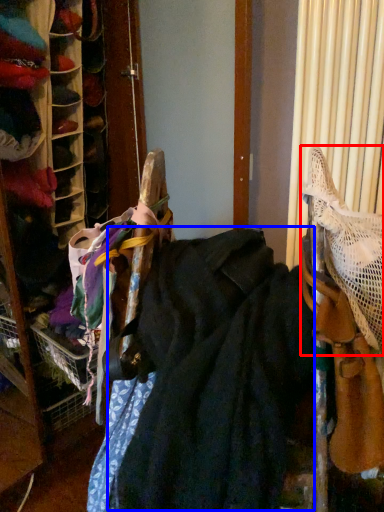
Question: Which object is closer to the camera taking this photo, wide (highlighted by a red box) or wide (highlighted by a blue box)?

Choices:
 (A) wide
 (B) wide

Answer: (B)